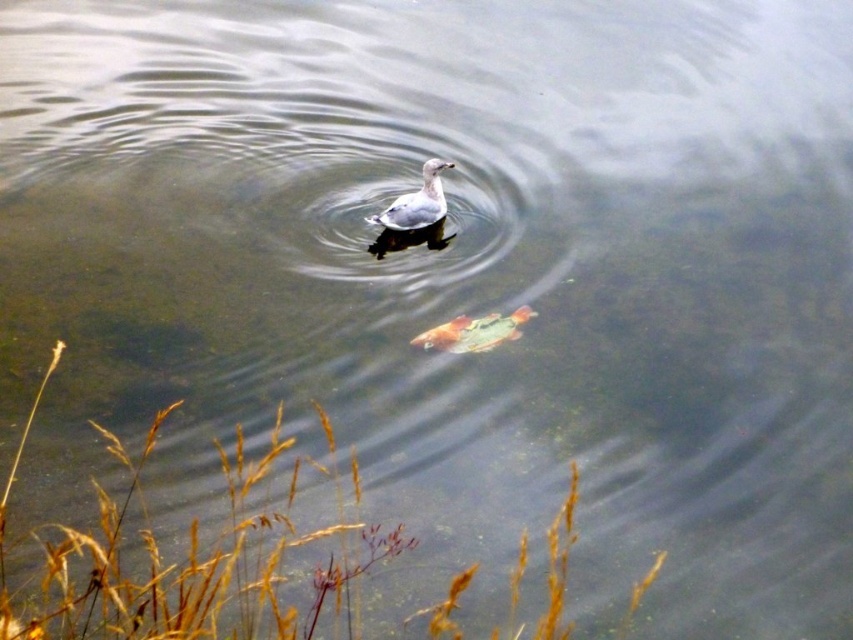
Which is in front, point (463, 339) or point (397, 220)?

Point (463, 339)

Who is lower down, shiny orange fish at center or white matte duck at center?

shiny orange fish at center

The width and height of the screenshot is (853, 640). In order to click on shiny orange fish at center in this screenshot , I will do `click(474, 332)`.